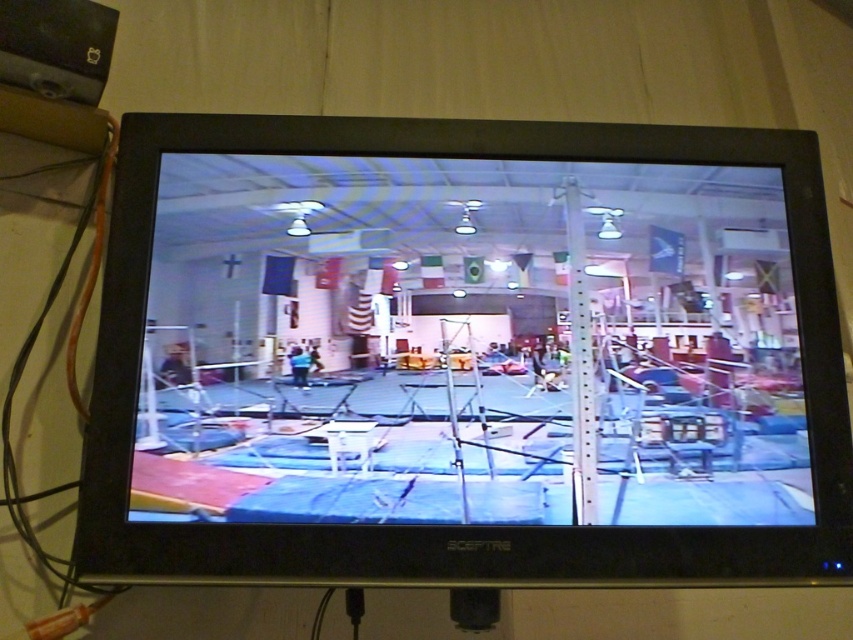
You are a gymnast preparing for a routine and need to locate your equipment. You see the blue mat at center and the orange cable at left. Which object is positioned to the right of the other?

The blue mat at center is positioned to the right of the orange cable at left.

Based on the photo, you are standing in the gymnasium watching the gymnastics practice. You notice two points marked on the floor at coordinates point (438, 390) and point (64, 266). If you want to walk from the first point to the second point, which direction should you move relative to your current position?

You should move backward because point (438, 390) is in front of point (64, 266), meaning the second point is behind your current position.

You are a gymnast preparing for a floor routine. You see the blue mat at center and the orange cable at left in the gymnasium. Which object should you avoid stepping on to prevent injury?

You should avoid stepping on the orange cable at left because the blue mat at center is bigger and likely provides a safer, cushioned surface for your routine.